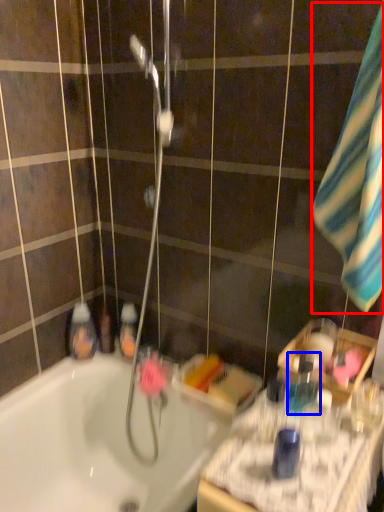
Question: Which point is closer to the camera, beach towel (highlighted by a red box) or mouthwash (highlighted by a blue box)?

Choices:
 (A) beach towel
 (B) mouthwash

Answer: (A)